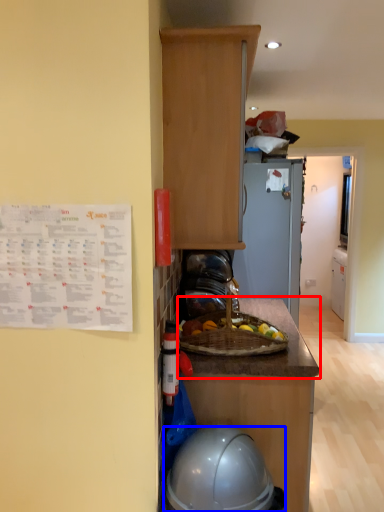
Question: Which of the following is the closest to the observer, countertop (highlighted by a red box) or helmet (highlighted by a blue box)?

Choices:
 (A) countertop
 (B) helmet

Answer: (B)